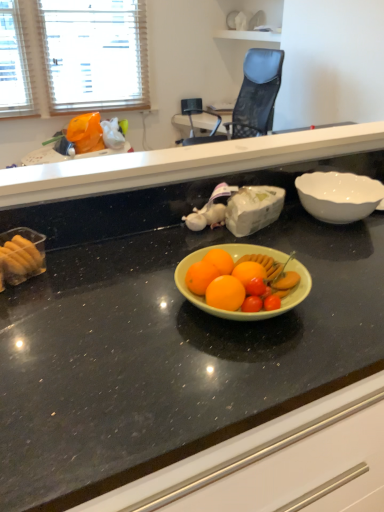
The width and height of the screenshot is (384, 512). What do you see at coordinates (181, 163) in the screenshot?
I see `black granite countertop at center, the first countertop positioned from the top` at bounding box center [181, 163].

Locate an element on the screen. This screenshot has height=512, width=384. black granite countertop at center, the first countertop positioned from the top is located at coordinates (181, 163).

In order to face white glossy bowl at right, should I rotate leftwards or rightwards?

It's best to rotate right around 18.405 degrees.

Image resolution: width=384 pixels, height=512 pixels. Identify the location of white glossy bowl at right. (338, 196).

Identify the location of blue mesh chair at upper center. (252, 98).

Based on the photo, from their relative heights in the image, would you say blue mesh chair at upper center is taller or shorter than white glossy bowl at right?

Considering their sizes, blue mesh chair at upper center has more height than white glossy bowl at right.

Can you tell me how much blue mesh chair at upper center and white glossy bowl at right differ in facing direction?

The angle between the facing direction of blue mesh chair at upper center and the facing direction of white glossy bowl at right is 87.8 degrees.

From a real-world perspective, is blue mesh chair at upper center positioned above or below white glossy bowl at right?

blue mesh chair at upper center is situated lower than white glossy bowl at right in the real world.

Looking at their sizes, would you say blue mesh chair at upper center is wider or thinner than white glossy bowl at right?

Clearly, blue mesh chair at upper center has more width compared to white glossy bowl at right.

Could you measure the distance between green matte bowl at center, which is counted as the second countertop, starting from the top, and white glossy bowl at right?

They are 39.69 centimeters apart.

At what (x,y) coordinates should I click in order to perform the action: click on the 1st countertop counting from the left side of the white glossy bowl at right. Please return your answer as a coordinate pair (x, y). This screenshot has width=384, height=512. Looking at the image, I should click on (165, 340).

Does green matte bowl at center, which is counted as the second countertop, starting from the top, have a greater width compared to white glossy bowl at right?

Yes, green matte bowl at center, which is counted as the second countertop, starting from the top, is wider than white glossy bowl at right.

Can you see green matte bowl at center, which is counted as the second countertop, starting from the top, touching white glossy bowl at right?

No, green matte bowl at center, which is counted as the second countertop, starting from the top, is not touching white glossy bowl at right.

Is white glossy bowl at right smaller than black granite countertop at center, the first countertop positioned from the top?

Yes.

Is white glossy bowl at right next to black granite countertop at center, the 2th countertop when ordered from bottom to top?

white glossy bowl at right and black granite countertop at center, the 2th countertop when ordered from bottom to top, are not in contact.

Which of these two, white glossy bowl at right or black granite countertop at center, the first countertop positioned from the top, stands taller?

Standing taller between the two is black granite countertop at center, the first countertop positioned from the top.

Considering the sizes of objects green matte bowl at center, which is counted as the second countertop, starting from the top, and black granite countertop at center, the 2th countertop when ordered from bottom to top, in the image provided, who is thinner, green matte bowl at center, which is counted as the second countertop, starting from the top, or black granite countertop at center, the 2th countertop when ordered from bottom to top,?

With smaller width is black granite countertop at center, the 2th countertop when ordered from bottom to top.

How different are the orientations of green matte bowl at center, which is counted as the second countertop, starting from the top, and black granite countertop at center, the first countertop positioned from the top, in degrees?

green matte bowl at center, which is counted as the second countertop, starting from the top, and black granite countertop at center, the first countertop positioned from the top, are facing 180 degrees away from each other.

Is green matte bowl at center, which is counted as the second countertop, starting from the top, aimed at black granite countertop at center, the first countertop positioned from the top?

No, green matte bowl at center, which is counted as the second countertop, starting from the top, is not turned towards black granite countertop at center, the first countertop positioned from the top.

Which is more to the right, green matte bowl at center, the 1th countertop when ordered from bottom to top, or black granite countertop at center, the 2th countertop when ordered from bottom to top?

Positioned to the right is green matte bowl at center, the 1th countertop when ordered from bottom to top.

From a real-world perspective, between black granite countertop at center, the first countertop positioned from the top, and blue mesh chair at upper center, who is vertically higher?

black granite countertop at center, the first countertop positioned from the top, is physically above.

Considering the positions of point (9, 195) and point (233, 133), is point (9, 195) closer or farther from the camera than point (233, 133)?

Point (9, 195) is positioned closer to the camera compared to point (233, 133).

Image resolution: width=384 pixels, height=512 pixels. I want to click on chair that appears above the black granite countertop at center, the first countertop positioned from the top (from the image's perspective), so click(x=252, y=98).

Is black granite countertop at center, the 2th countertop when ordered from bottom to top, not near blue mesh chair at upper center?

Answer: Absolutely, black granite countertop at center, the 2th countertop when ordered from bottom to top, is distant from blue mesh chair at upper center.

Consider the image. Would you say black granite countertop at center, the 2th countertop when ordered from bottom to top, is a long distance from green matte bowl at center, which is counted as the second countertop, starting from the top?

No, black granite countertop at center, the 2th countertop when ordered from bottom to top, is not far from green matte bowl at center, which is counted as the second countertop, starting from the top.

Could you tell me if black granite countertop at center, the first countertop positioned from the top, is turned towards green matte bowl at center, the 1th countertop when ordered from bottom to top?

No, black granite countertop at center, the first countertop positioned from the top, is not aimed at green matte bowl at center, the 1th countertop when ordered from bottom to top.

Is point (360, 133) closer or farther from the camera than point (139, 347)?

Clearly, point (360, 133) is more distant from the camera than point (139, 347).

Is black granite countertop at center, the first countertop positioned from the top, at the left side of green matte bowl at center, the 1th countertop when ordered from bottom to top?

Correct, you'll find black granite countertop at center, the first countertop positioned from the top, to the left of green matte bowl at center, the 1th countertop when ordered from bottom to top.

From the picture: Could you tell me if blue mesh chair at upper center is facing black granite countertop at center, the 2th countertop when ordered from bottom to top?

No, blue mesh chair at upper center is not facing towards black granite countertop at center, the 2th countertop when ordered from bottom to top.

Can you confirm if blue mesh chair at upper center is positioned to the right of black granite countertop at center, the 2th countertop when ordered from bottom to top?

Yes, blue mesh chair at upper center is to the right of black granite countertop at center, the 2th countertop when ordered from bottom to top.

Considering the relative sizes of blue mesh chair at upper center and black granite countertop at center, the 2th countertop when ordered from bottom to top, in the image provided, is blue mesh chair at upper center bigger than black granite countertop at center, the 2th countertop when ordered from bottom to top,?

Correct, blue mesh chair at upper center is larger in size than black granite countertop at center, the 2th countertop when ordered from bottom to top.

This screenshot has height=512, width=384. Identify the location of chair behind the white glossy bowl at right. (252, 98).

Where is `the 2nd countertop in front of the white glossy bowl at right, starting your count from the anchor`? This screenshot has height=512, width=384. the 2nd countertop in front of the white glossy bowl at right, starting your count from the anchor is located at coordinates (165, 340).

From the image, which object appears to be nearer to blue mesh chair at upper center, green matte bowl at center, which is counted as the second countertop, starting from the top, or white glossy bowl at right?

white glossy bowl at right.

When comparing their distances from white glossy bowl at right, does blue mesh chair at upper center or green matte bowl at center, which is counted as the second countertop, starting from the top, seem closer?

green matte bowl at center, which is counted as the second countertop, starting from the top.

When comparing their distances from black granite countertop at center, the first countertop positioned from the top, does blue mesh chair at upper center or green matte bowl at center, which is counted as the second countertop, starting from the top, seem further?

Among the two, blue mesh chair at upper center is located further to black granite countertop at center, the first countertop positioned from the top.

When comparing their distances from blue mesh chair at upper center, does white glossy bowl at right or black granite countertop at center, the first countertop positioned from the top, seem closer?

black granite countertop at center, the first countertop positioned from the top.

In the scene shown: From the image, which object appears to be farther from green matte bowl at center, which is counted as the second countertop, starting from the top, blue mesh chair at upper center or black granite countertop at center, the first countertop positioned from the top?

blue mesh chair at upper center is positioned further to the anchor green matte bowl at center, which is counted as the second countertop, starting from the top.

Looking at the image, which one is located closer to white glossy bowl at right, blue mesh chair at upper center or black granite countertop at center, the first countertop positioned from the top?

black granite countertop at center, the first countertop positioned from the top.

Which object lies nearer to the anchor point white glossy bowl at right, black granite countertop at center, the 2th countertop when ordered from bottom to top, or blue mesh chair at upper center?

Among the two, black granite countertop at center, the 2th countertop when ordered from bottom to top, is located nearer to white glossy bowl at right.

Based on their spatial positions, is green matte bowl at center, which is counted as the second countertop, starting from the top, or blue mesh chair at upper center further from white glossy bowl at right?

blue mesh chair at upper center is positioned further to the anchor white glossy bowl at right.

Where is `bowl between black granite countertop at center, the 2th countertop when ordered from bottom to top, and blue mesh chair at upper center from front to back`? The height and width of the screenshot is (512, 384). bowl between black granite countertop at center, the 2th countertop when ordered from bottom to top, and blue mesh chair at upper center from front to back is located at coordinates (338, 196).

At what (x,y) coordinates should I click in order to perform the action: click on bowl between black granite countertop at center, the 2th countertop when ordered from bottom to top, and green matte bowl at center, the 1th countertop when ordered from bottom to top, from top to bottom. Please return your answer as a coordinate pair (x, y). The width and height of the screenshot is (384, 512). Looking at the image, I should click on (338, 196).

At what (x,y) coordinates should I click in order to perform the action: click on countertop between green matte bowl at center, the 1th countertop when ordered from bottom to top, and blue mesh chair at upper center in the front-back direction. Please return your answer as a coordinate pair (x, y). The width and height of the screenshot is (384, 512). Looking at the image, I should click on (181, 163).

Locate an element on the screen. The width and height of the screenshot is (384, 512). bowl between green matte bowl at center, which is counted as the second countertop, starting from the top, and blue mesh chair at upper center from front to back is located at coordinates (338, 196).